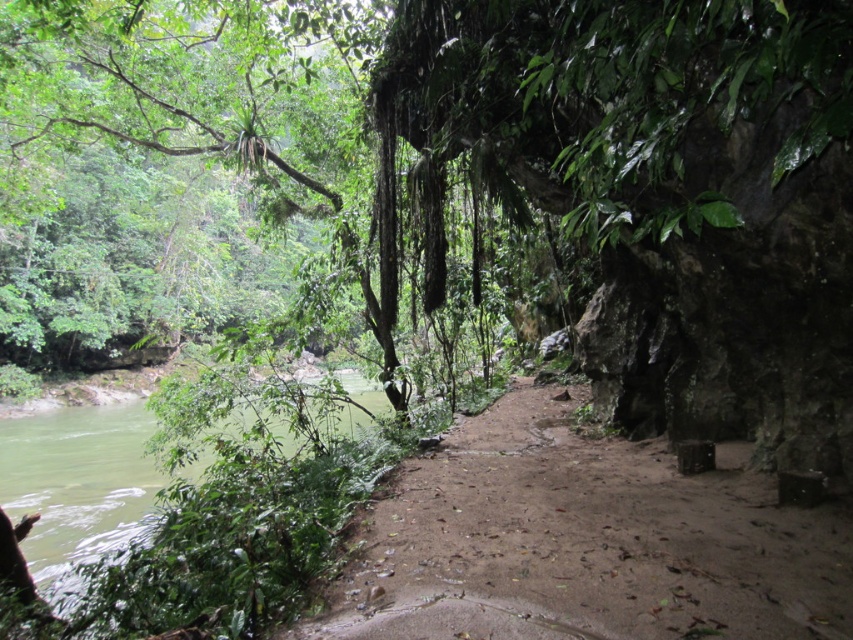
You are a hiker planning to walk along the brown sandy dirt track at center. You notice the green leafy tree at upper left in the distance. Which object would you encounter first if you start walking straight ahead along the track?

You would first encounter the brown sandy dirt track at center before the green leafy tree at upper left because the tree is further away from the starting point.

You are standing at the point marked as point (173, 164) in the image. What object is located exactly at that point?

The green leafy tree at upper left is located exactly at point (173, 164).

You are a hiker trying to follow the dirt path in the forest. You notice a green leafy tree at upper left and a brown sandy dirt track at center. Which direction should you walk to stay on the path?

To stay on the path, you should walk towards the brown sandy dirt track at center, as the green leafy tree at upper left is located to the left of the track, indicating the path is ahead in the center direction.